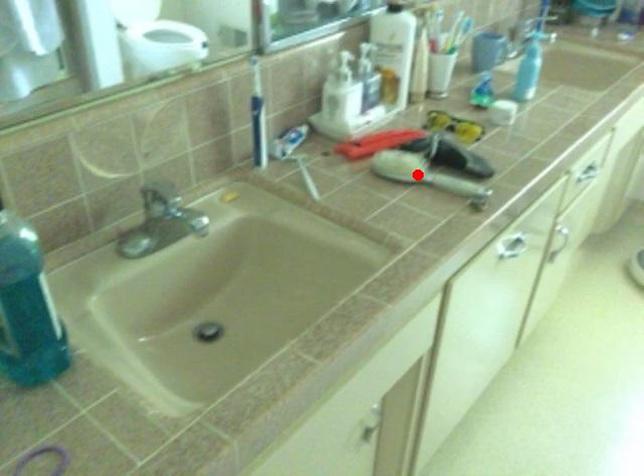
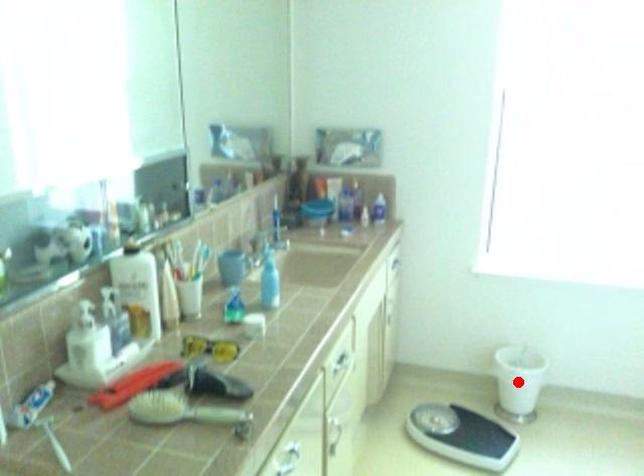
I am providing you with two images of the same scene from different viewpoints. A red point is marked on the first image and another point is marked on the second image. Is the marked point in image1 the same physical position as the marked point in image2?

No